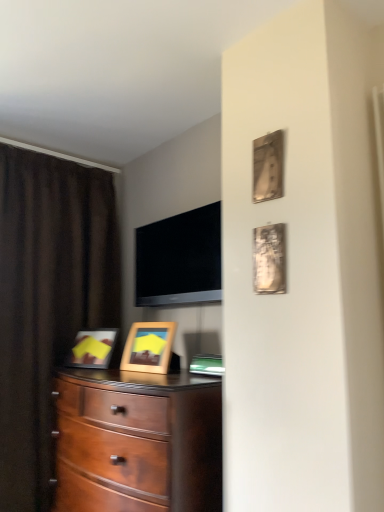
Question: Considering the positions of point (256, 186) and point (185, 228), is point (256, 186) closer or farther from the camera than point (185, 228)?

Choices:
 (A) farther
 (B) closer

Answer: (B)

Question: Relative to flat screen tv at upper center, is metallic silver picture frame at upper right, the first picture frame in the top-to-bottom sequence, in front or behind?

Choices:
 (A) behind
 (B) front

Answer: (B)

Question: Which object is the closest to the wooden picture frame at center, which appears as the first picture frame when viewed from the back?

Choices:
 (A) metallic silver picture frame at upper right, acting as the second picture frame starting from the back
 (B) brown fabric curtain at left
 (C) flat screen tv at upper center
 (D) metallic silver picture frame at upper right, which appears as the 3th picture frame when viewed from the left
 (E) mahogany wood dresser at center

Answer: (E)

Question: Which object is the closest to the metallic silver picture frame at upper right, acting as the second picture frame starting from the back?

Choices:
 (A) mahogany wood dresser at center
 (B) wooden picture frame at center, the first picture frame ordered from the bottom
 (C) metallic silver picture frame at upper right, the first picture frame when ordered from front to back
 (D) brown fabric curtain at left
 (E) flat screen tv at upper center

Answer: (C)